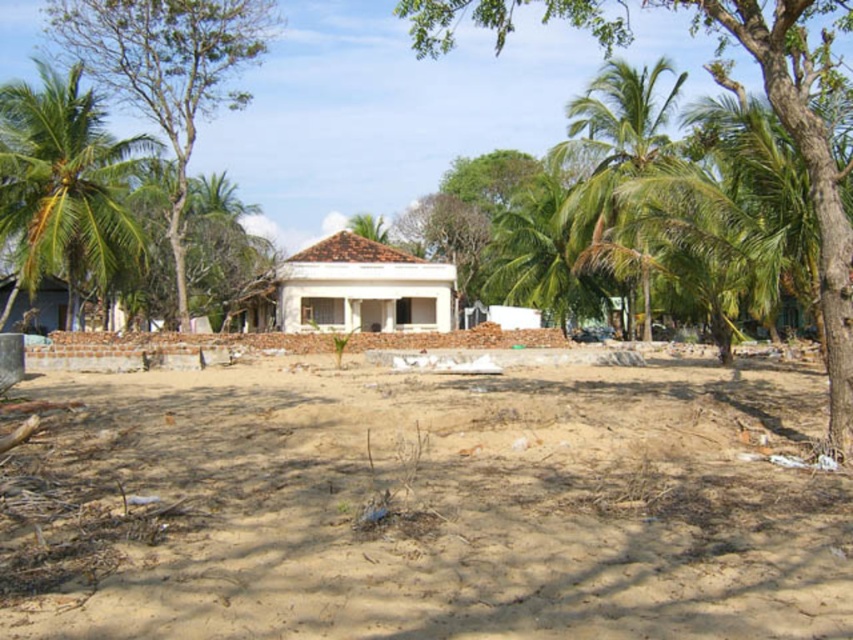
Question: Where is white matte house at center located in relation to matte white hut at lower left in the image?

Choices:
 (A) left
 (B) right

Answer: (B)

Question: Can you confirm if green leafy tree at center is positioned above green leafy tree at left?

Choices:
 (A) yes
 (B) no

Answer: (B)

Question: Which is nearer to the green leafy palm tree at right?

Choices:
 (A) matte white hut at lower left
 (B) brown sandy dirt field at center
 (C) green leafy palm tree at left

Answer: (B)

Question: Which point appears closest to the camera in this image?

Choices:
 (A) (254, 54)
 (B) (503, 256)
 (C) (297, 284)

Answer: (A)

Question: Which point is closer to the camera taking this photo?

Choices:
 (A) (364, 536)
 (B) (395, 323)
 (C) (55, 317)

Answer: (A)

Question: Does white matte house at center appear over green leafy palm tree at right?

Choices:
 (A) no
 (B) yes

Answer: (A)